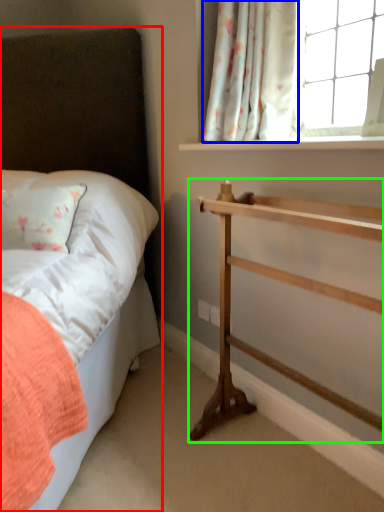
Question: Which object is positioned closest to bed (highlighted by a red box)? Select from curtain (highlighted by a blue box) and shelf (highlighted by a green box).

Choices:
 (A) curtain
 (B) shelf

Answer: (A)